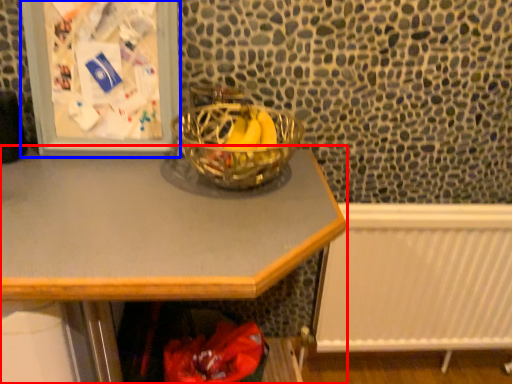
Question: Which point is closer to the camera, desk (highlighted by a red box) or picture frame (highlighted by a blue box)?

Choices:
 (A) desk
 (B) picture frame

Answer: (A)